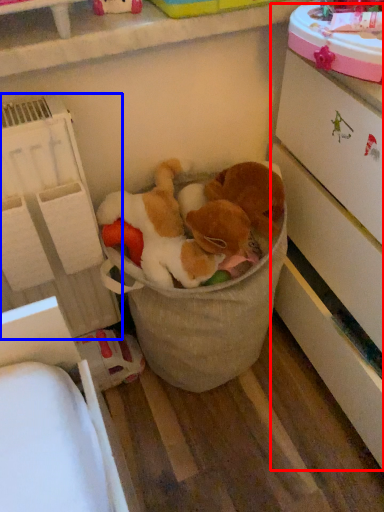
Question: Which object appears closest to the camera in this image, cabinetry (highlighted by a red box) or shelf (highlighted by a blue box)?

Choices:
 (A) cabinetry
 (B) shelf

Answer: (A)